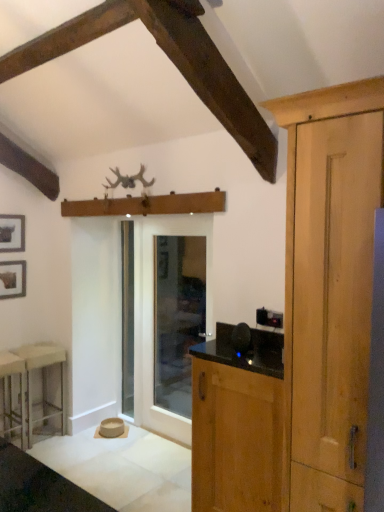
The image size is (384, 512). I want to click on empty space that is ontop of metallic silver stool at lower left, which is the 2th stool from back to front (from a real-world perspective), so click(x=5, y=356).